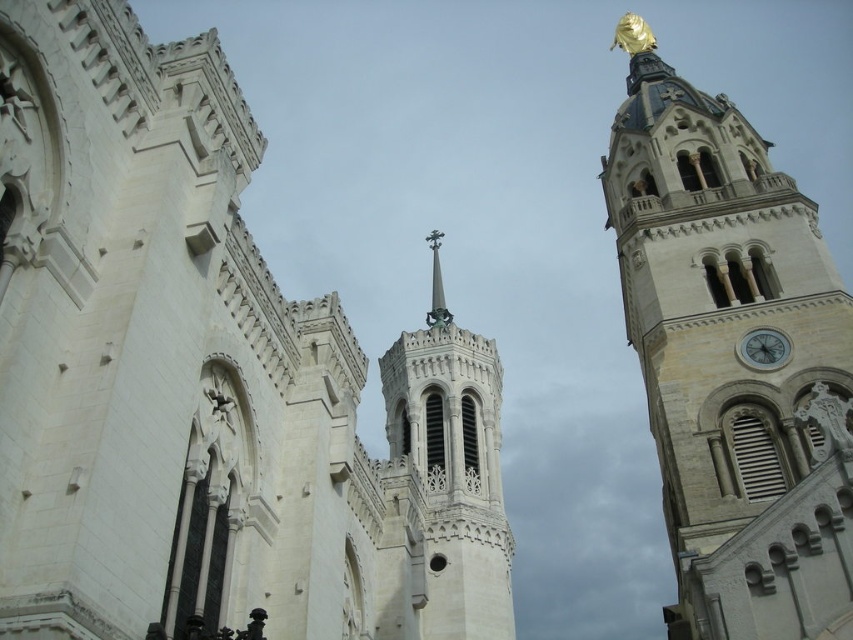
Question: Based on their relative distances, which object is nearer to the white stone spire at center?

Choices:
 (A) golden statue at upper right
 (B) white stone church at center

Answer: (B)

Question: Is golden statue at upper right positioned behind white stone spire at center?

Choices:
 (A) no
 (B) yes

Answer: (A)

Question: Which point appears farthest from the camera in this image?

Choices:
 (A) (422, 396)
 (B) (670, 300)

Answer: (A)

Question: Is the position of white stone church at center more distant than that of white stone clock at right?

Choices:
 (A) yes
 (B) no

Answer: (B)

Question: Among these objects, which one is farthest from the camera?

Choices:
 (A) golden statue at upper right
 (B) white stone clock at right

Answer: (B)

Question: Can you confirm if white stone church at center is positioned above golden statue at upper right?

Choices:
 (A) no
 (B) yes

Answer: (A)